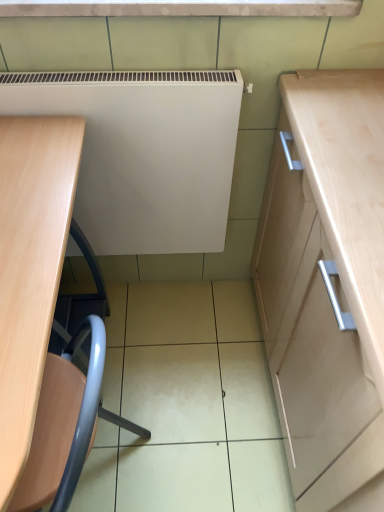
Question: From their relative heights in the image, would you say light wood desk at left is taller or shorter than metallic blue swivel chair at lower left?

Choices:
 (A) tall
 (B) short

Answer: (A)

Question: From a real-world perspective, is light wood desk at left physically located above or below metallic blue swivel chair at lower left?

Choices:
 (A) below
 (B) above

Answer: (B)

Question: Which of these objects is positioned closest to the light wood desk at left?

Choices:
 (A) metallic blue swivel chair at lower left
 (B) white matte radiator at center

Answer: (A)

Question: Which object is positioned farthest from the white matte radiator at center?

Choices:
 (A) metallic blue swivel chair at lower left
 (B) light wood desk at left

Answer: (A)